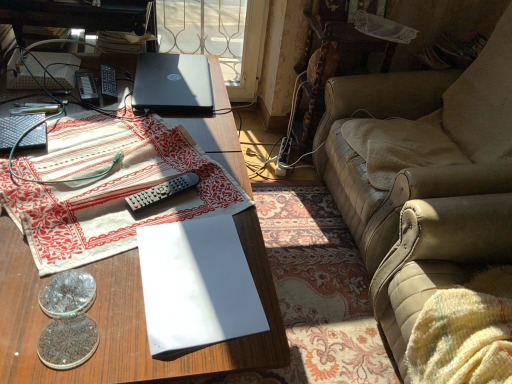
Find the location of a particular element. This screenshot has height=384, width=512. vacant area that lies between black plastic remote control at center, acting as the 2th remote control starting from the right, and translucent glass coins at lower left, the first coin viewed from the front is located at coordinates (94, 182).